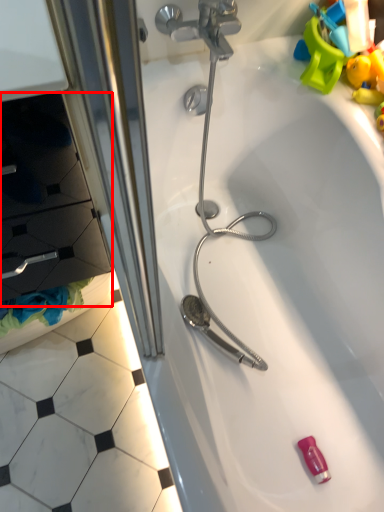
Question: From the image's perspective, considering the relative positions of drawer (annotated by the red box) and bathtub in the image provided, where is drawer (annotated by the red box) located with respect to the staircase?

Choices:
 (A) above
 (B) below

Answer: (A)